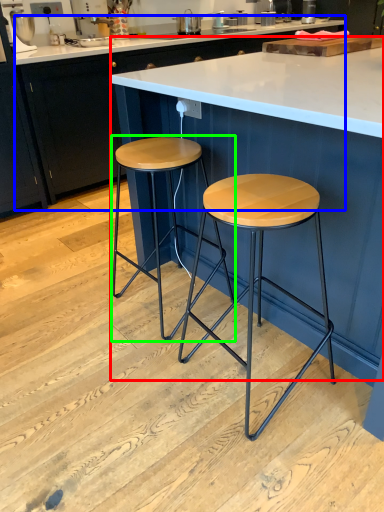
Question: Considering the real-world distances, which object is farthest from table (highlighted by a red box)? cabinetry (highlighted by a blue box) or stool (highlighted by a green box)?

Choices:
 (A) cabinetry
 (B) stool

Answer: (A)